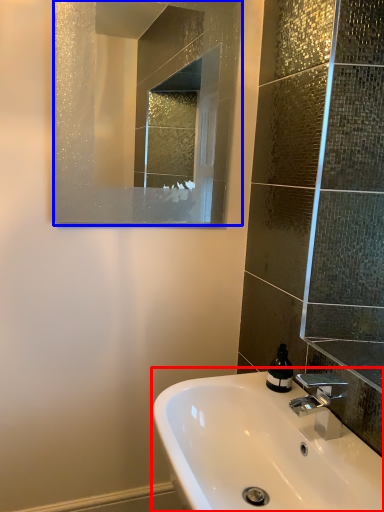
Question: Which of the following is the closest to the observer, sink (highlighted by a red box) or mirror (highlighted by a blue box)?

Choices:
 (A) sink
 (B) mirror

Answer: (A)